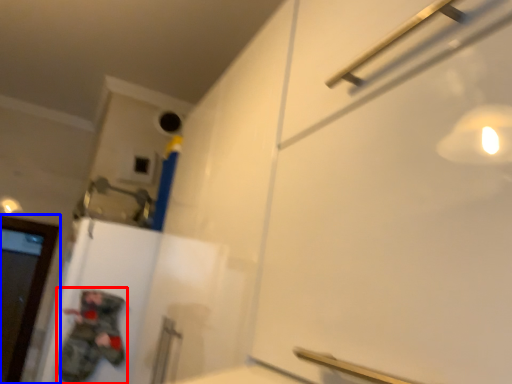
Question: Among these objects, which one is nearest to the camera, person (highlighted by a red box) or door (highlighted by a blue box)?

Choices:
 (A) person
 (B) door

Answer: (A)